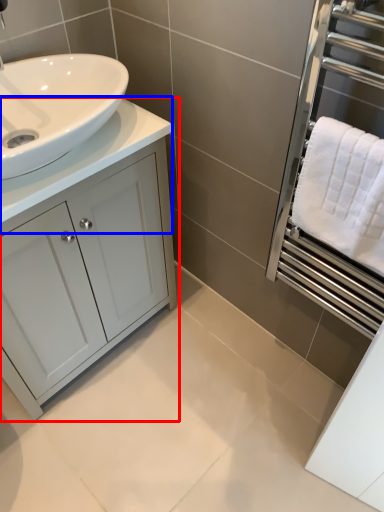
Question: Which of the following is the closest to the observer, bathroom cabinet (highlighted by a red box) or counter top (highlighted by a blue box)?

Choices:
 (A) bathroom cabinet
 (B) counter top

Answer: (B)